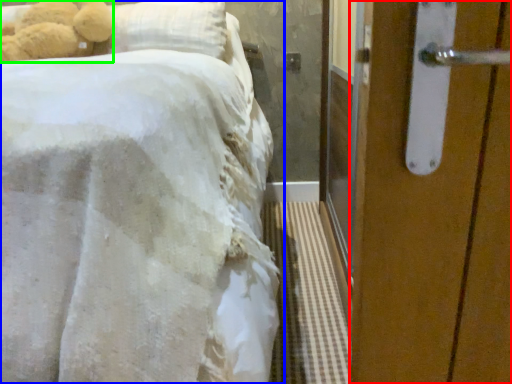
Question: Which object is positioned farthest from door (highlighted by a red box)? Select from bed (highlighted by a blue box) and teddy bear (highlighted by a green box).

Choices:
 (A) bed
 (B) teddy bear

Answer: (B)